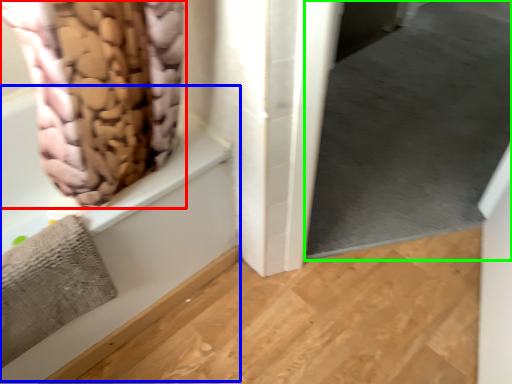
Question: Which object is positioned farthest from curtain (highlighted by a red box)? Select from bath (highlighted by a blue box) and window screen (highlighted by a green box).

Choices:
 (A) bath
 (B) window screen

Answer: (B)